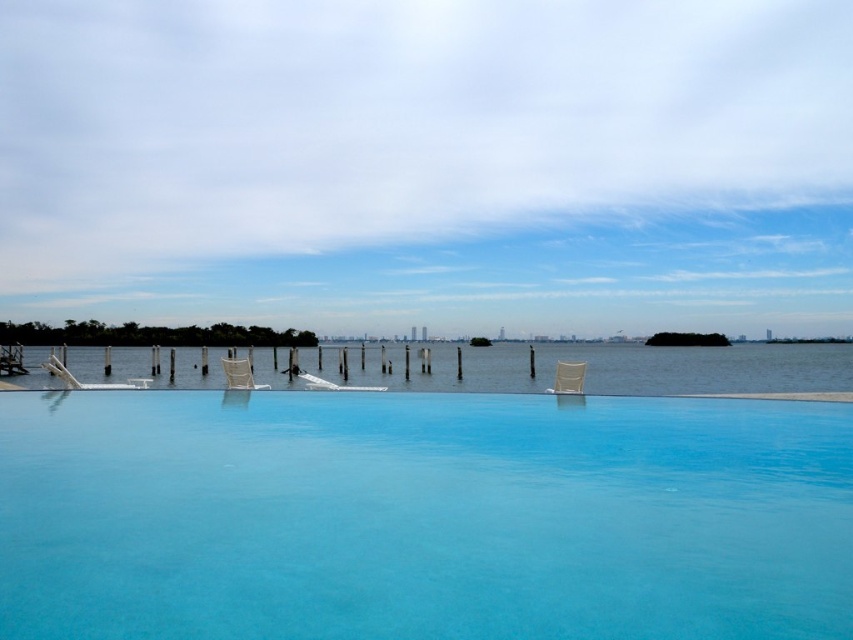
Consider the image. Can you confirm if white fabric beach chair at center is positioned to the left of beige fabric beach chair at center?

Incorrect, white fabric beach chair at center is not on the left side of beige fabric beach chair at center.

Between white fabric beach chair at center and beige fabric beach chair at center, which one is positioned lower?

beige fabric beach chair at center is lower down.

This screenshot has height=640, width=853. I want to click on white fabric beach chair at center, so click(x=567, y=378).

This screenshot has width=853, height=640. What are the coordinates of `white fabric beach chair at center` in the screenshot? It's located at (567, 378).

What are the coordinates of `transparent glass pool at center` in the screenshot? It's located at (422, 516).

Which is below, transparent glass pool at center or white fabric beach chair at center?

transparent glass pool at center

This screenshot has width=853, height=640. Find the location of `transparent glass pool at center`. transparent glass pool at center is located at coordinates (422, 516).

Is point (126, 576) positioned before point (549, 360)?

Yes, it is.

You are a GUI agent. You are given a task and a screenshot of the screen. Output one action in this format:
    pyautogui.click(x=<x>, y=<y>)
    Task: Click on the transparent glass pool at center
    This screenshot has height=640, width=853.
    Given the screenshot: What is the action you would take?
    pyautogui.click(x=422, y=516)

Where is `transparent glass pool at center`? This screenshot has height=640, width=853. transparent glass pool at center is located at coordinates (422, 516).